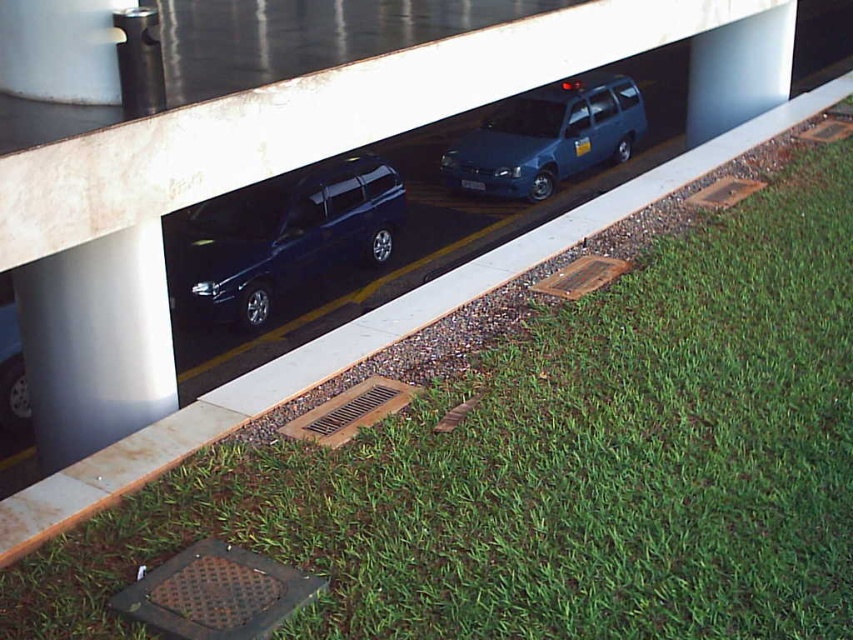
Question: From the image, what is the correct spatial relationship of glossy dark blue minivan at center in relation to smooth concrete pillar at upper center?

Choices:
 (A) above
 (B) below

Answer: (B)

Question: Among these objects, which one is nearest to the camera?

Choices:
 (A) metallic blue minivan at center
 (B) satin silver pillar at center left
 (C) glossy dark blue minivan at center
 (D) smooth concrete pillar at upper center

Answer: (B)

Question: Which of the following is the farthest from the observer?

Choices:
 (A) (393, 232)
 (B) (778, 51)
 (C) (520, 132)
 (D) (57, 372)

Answer: (C)

Question: Is satin silver pillar at center left smaller than glossy dark blue minivan at center?

Choices:
 (A) no
 (B) yes

Answer: (B)

Question: Is glossy dark blue minivan at center further to the viewer compared to smooth concrete pillar at upper center?

Choices:
 (A) no
 (B) yes

Answer: (A)

Question: Which object appears farthest from the camera in this image?

Choices:
 (A) glossy dark blue minivan at center
 (B) satin silver pillar at center left

Answer: (A)